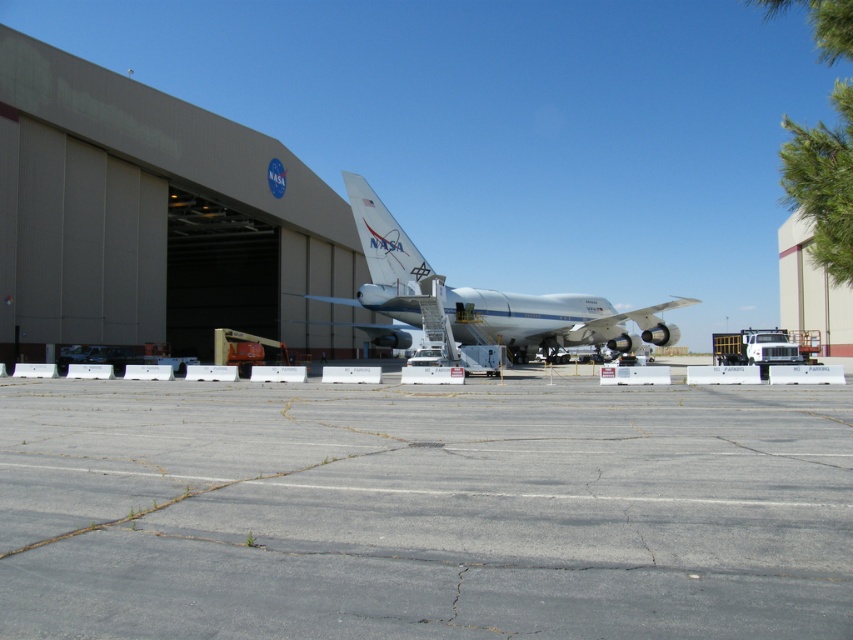
Question: Does gray asphalt tarmac at center come behind white metallic airplane at center?

Choices:
 (A) yes
 (B) no

Answer: (B)

Question: Which of the following is the farthest from the observer?

Choices:
 (A) white metallic airplane at center
 (B) gray asphalt tarmac at center

Answer: (A)

Question: Which object appears farthest from the camera in this image?

Choices:
 (A) white metallic airplane at center
 (B) gray asphalt tarmac at center

Answer: (A)

Question: Is gray asphalt tarmac at center thinner than white metallic airplane at center?

Choices:
 (A) no
 (B) yes

Answer: (B)

Question: Does gray asphalt tarmac at center have a smaller size compared to white metallic airplane at center?

Choices:
 (A) yes
 (B) no

Answer: (A)